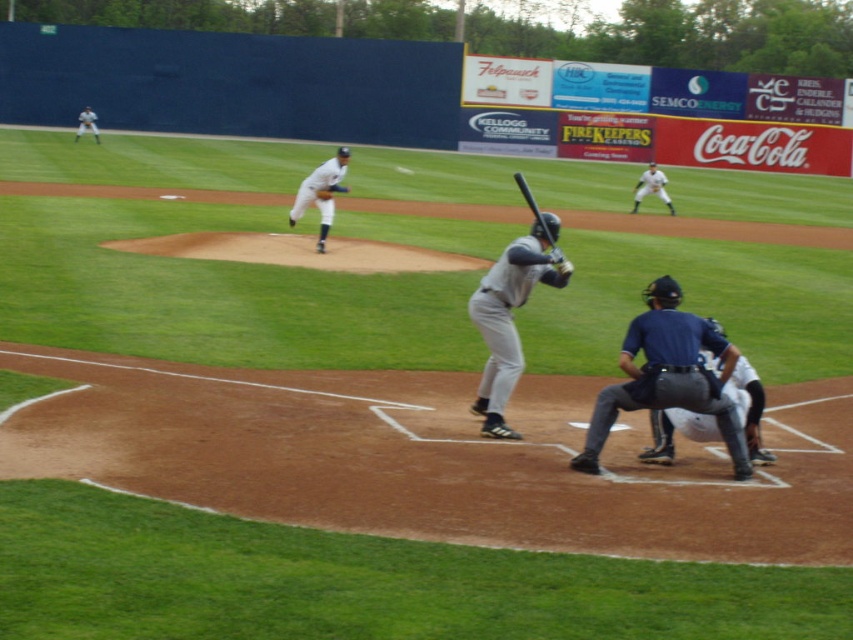
You are a drone operator trying to capture a wide shot of the baseball game. The gray matte uniform at center is the batter, and the white uniform at upper right is an outfielder. Your drone can only fly up to 20 meters away from the batter. Can your drone stay within range while filming the outfielder?

The distance between the gray matte uniform at center and the white uniform at upper right is 21.01 meters, which exceeds the drone operator can only fly up to 20 meters away from the batter. Therefore, the drone cannot stay within range while filming the outfielder.

You are a spectator at the baseball game and want to take a photo of both the dark blue uniform at lower right and the white uniform at center. Which one should you zoom in on first to ensure both are in frame?

You should zoom in on the white uniform at center first because the dark blue uniform at lower right is located below it, so adjusting the frame to include the lower area will still capture the white uniform at center.